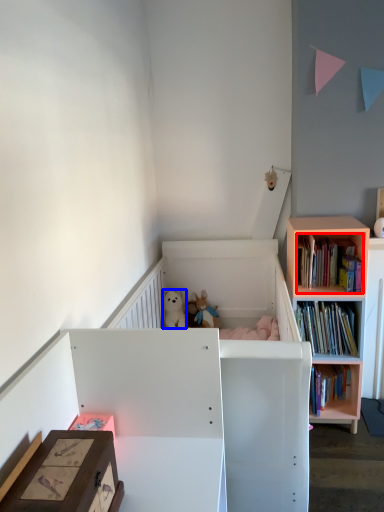
Question: Which of the following is the farthest to the observer, book (highlighted by a red box) or animal (highlighted by a blue box)?

Choices:
 (A) book
 (B) animal

Answer: (B)